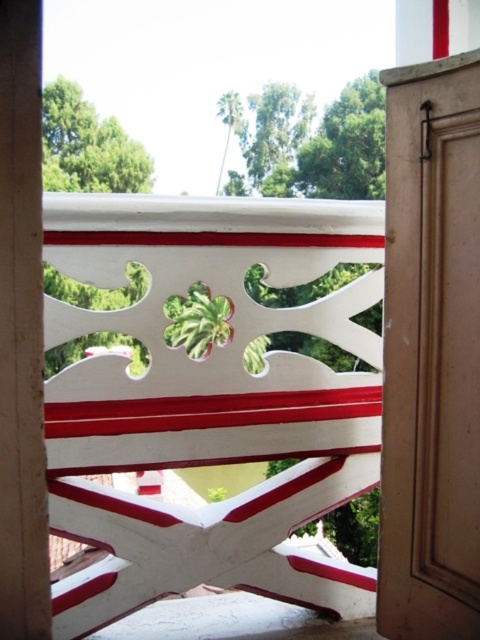
Question: Does matte brown door at right have a smaller size compared to wooden at left?

Choices:
 (A) yes
 (B) no

Answer: (B)

Question: Does matte brown door at right appear under wooden at left?

Choices:
 (A) yes
 (B) no

Answer: (B)

Question: Which point is closer to the camera?

Choices:
 (A) wooden at left
 (B) matte brown door at right

Answer: (A)

Question: Can you confirm if matte brown door at right is positioned below wooden at left?

Choices:
 (A) yes
 (B) no

Answer: (B)

Question: Among these objects, which one is nearest to the camera?

Choices:
 (A) matte brown door at right
 (B) wooden at left

Answer: (B)